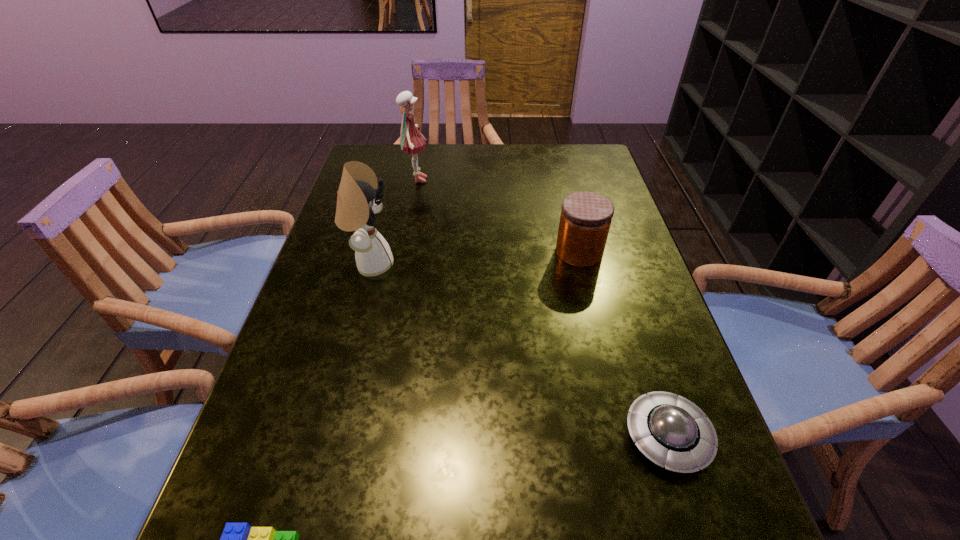
Find the location of a particular element. The width and height of the screenshot is (960, 540). the nearer doll is located at coordinates [x=357, y=201].

Image resolution: width=960 pixels, height=540 pixels. Find the location of `the farther doll`. the farther doll is located at coordinates (411, 141).

You are a GUI agent. You are given a task and a screenshot of the screen. Output one action in this format:
    pyautogui.click(x=<x>, y=<y>)
    Task: Click on the third tallest object
    The image size is (960, 540).
    Given the screenshot: What is the action you would take?
    pyautogui.click(x=585, y=219)

You are a GUI agent. You are given a task and a screenshot of the screen. Output one action in this format:
    pyautogui.click(x=<x>, y=<y>)
    Task: Click on the fourth farthest object
    
    Given the screenshot: What is the action you would take?
    pyautogui.click(x=671, y=431)

This screenshot has width=960, height=540. In order to click on blank area located at the front face of the nearer doll in this screenshot , I will do `click(453, 264)`.

Locate an element on the screen. The height and width of the screenshot is (540, 960). vacant space situated on the front-facing side of the farther doll is located at coordinates (483, 180).

Identify the location of free region located on the front of the third shortest object. The width and height of the screenshot is (960, 540). (597, 328).

This screenshot has width=960, height=540. I want to click on vacant area situated 0.330m on the back of the second nearest object, so click(x=615, y=272).

You are a GUI agent. You are given a task and a screenshot of the screen. Output one action in this format:
    pyautogui.click(x=<x>, y=<y>)
    Task: Click on the object present at the far edge
    The height and width of the screenshot is (540, 960).
    Given the screenshot: What is the action you would take?
    pyautogui.click(x=411, y=141)

Where is `jar located in the right edge section of the desktop`? jar located in the right edge section of the desktop is located at coordinates (585, 219).